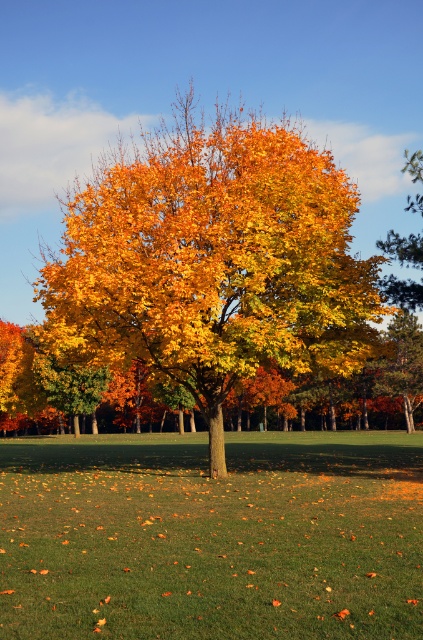
You are standing in the autumn scene and want to pick up the golden yellow leaves at upper right. Which direction should you move relative to the golden leafy tree at center?

You should move to the right of the golden leafy tree at center to reach the golden yellow leaves at upper right since the golden leafy tree at center is to the left of golden yellow leaves at upper right.